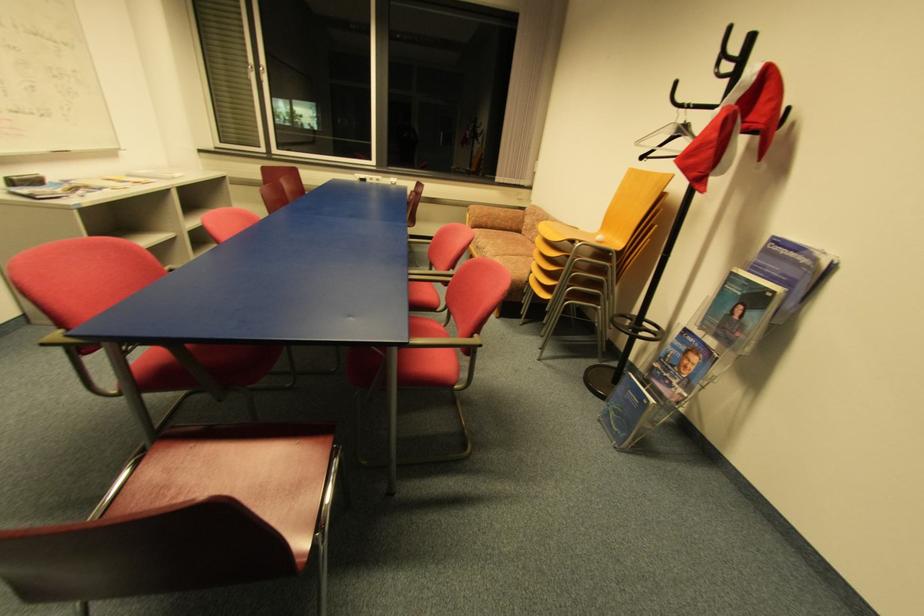
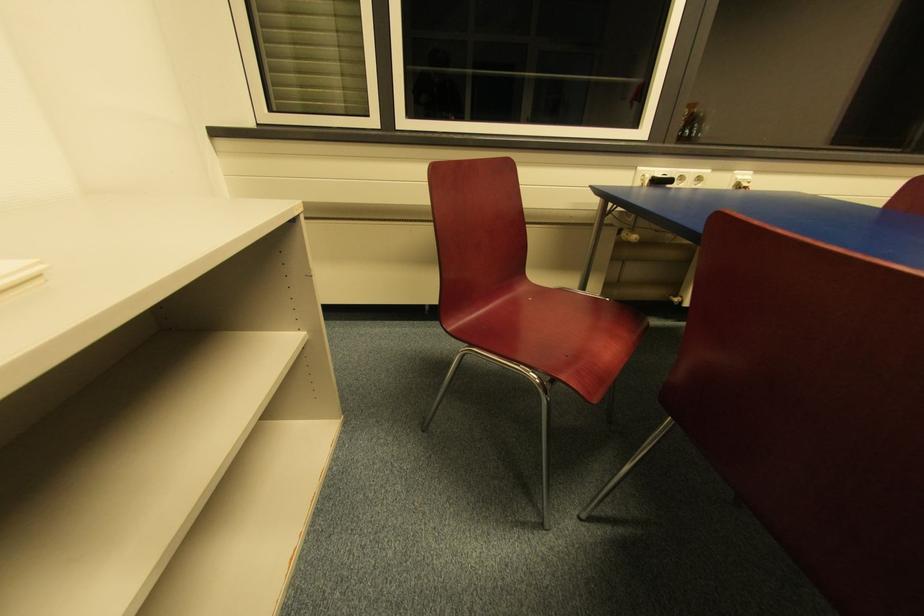
In a continuous first-person perspective shot, in which direction is the camera moving?

The movement direction of the cameraman is left, forward.